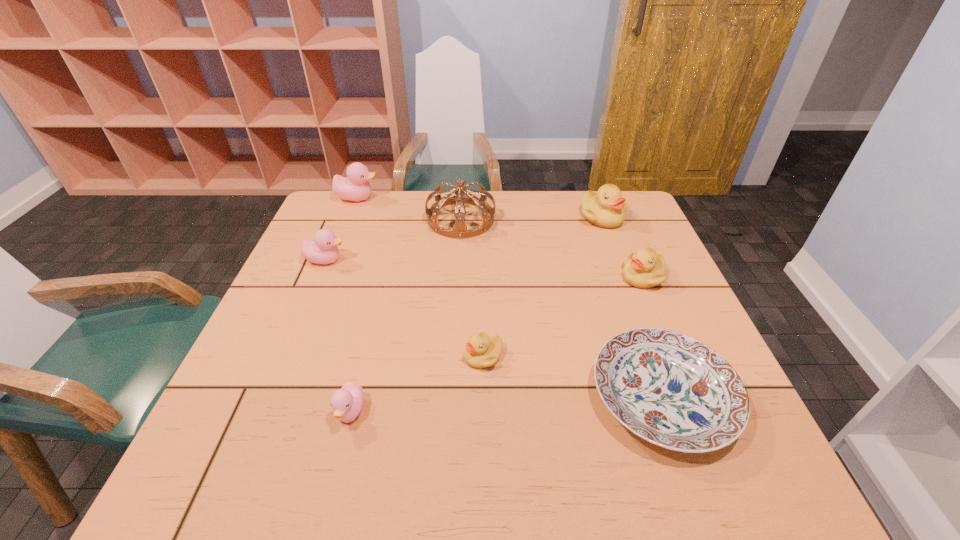
Identify which object is located as the fifth nearest to the plate. Please provide its 2D coordinates. Your answer should be formatted as a tuple, i.e. [(x, y)], where the tuple contains the x and y coordinates of a point satisfying the conditions above.

[(346, 402)]

You are a GUI agent. You are given a task and a screenshot of the screen. Output one action in this format:
    pyautogui.click(x=<x>, y=<y>)
    Task: Click on the object that is the sixth closest to the smallest yellow duckling
    
    Given the screenshot: What is the action you would take?
    pyautogui.click(x=606, y=208)

Identify which duckling is located as the third nearest to the farthest pink duckling. Please provide its 2D coordinates. Your answer should be formatted as a tuple, i.e. [(x, y)], where the tuple contains the x and y coordinates of a point satisfying the conditions above.

[(482, 351)]

Identify which duckling is located as the nearest to the farthest yellow duckling. Please provide its 2D coordinates. Your answer should be formatted as a tuple, i.e. [(x, y)], where the tuple contains the x and y coordinates of a point satisfying the conditions above.

[(645, 269)]

Identify which pink duckling is located as the second nearest to the second nearest yellow duckling. Please provide its 2D coordinates. Your answer should be formatted as a tuple, i.e. [(x, y)], where the tuple contains the x and y coordinates of a point satisfying the conditions above.

[(323, 249)]

Find the location of a particular element. Image resolution: width=960 pixels, height=540 pixels. pink duckling identified as the closest to the farthest yellow duckling is located at coordinates (355, 187).

Select which yellow duckling appears as the third closest to the farthest pink duckling. Please provide its 2D coordinates. Your answer should be formatted as a tuple, i.e. [(x, y)], where the tuple contains the x and y coordinates of a point satisfying the conditions above.

[(645, 269)]

Find the location of a particular element. the second closest yellow duckling relative to the nearest yellow duckling is located at coordinates (606, 208).

The height and width of the screenshot is (540, 960). I want to click on vacant space that satisfies the following two spatial constraints: 1. on the front-facing side of the farthest yellow duckling; 2. on the front-facing side of the second nearest pink duckling, so click(x=618, y=260).

Image resolution: width=960 pixels, height=540 pixels. I want to click on free space in the image that satisfies the following two spatial constraints: 1. on the front-facing side of the biggest pink duckling; 2. on the right side of the plate, so click(x=277, y=397).